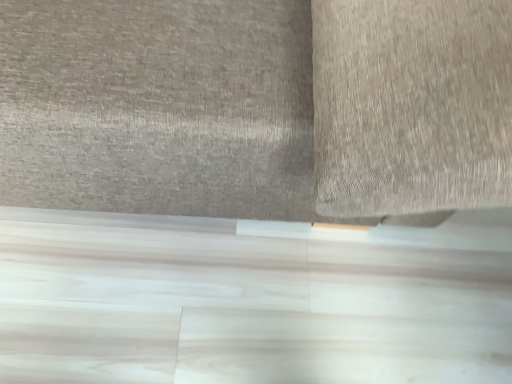
What do you see at coordinates (252, 300) in the screenshot?
I see `white wood baseboard at lower center` at bounding box center [252, 300].

I want to click on white wood baseboard at lower center, so click(x=252, y=300).

Where is `white wood baseboard at lower center`? white wood baseboard at lower center is located at coordinates (252, 300).